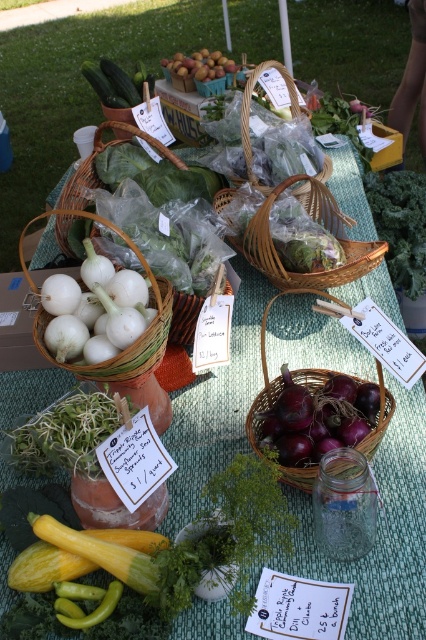
Question: Which of the following is the closest to the observer?

Choices:
 (A) (293, 371)
 (B) (267, 221)
 (C) (192, 298)

Answer: (A)

Question: Which object appears closest to the camera in this image?

Choices:
 (A) woven brown basket at center
 (B) white woven basket at center

Answer: (B)

Question: Can you confirm if woven brown basket at center is smaller than smooth yellow squash at center?

Choices:
 (A) yes
 (B) no

Answer: (A)

Question: Does shiny red onion basket at center appear over smooth yellow squash at center?

Choices:
 (A) no
 (B) yes

Answer: (A)

Question: Which object is positioned closest to the green matte pepper at lower left?

Choices:
 (A) green leafy kale at upper right
 (B) white woven basket at left

Answer: (B)

Question: Does white woven basket at left have a smaller size compared to white woven basket at center?

Choices:
 (A) yes
 (B) no

Answer: (A)